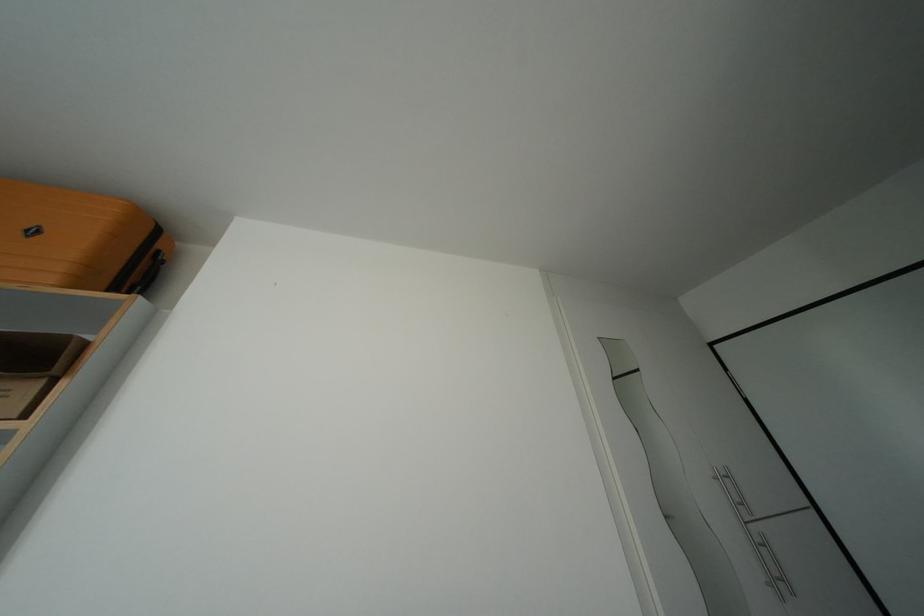
The image size is (924, 616). I want to click on black suitcase handle, so pos(148,274).